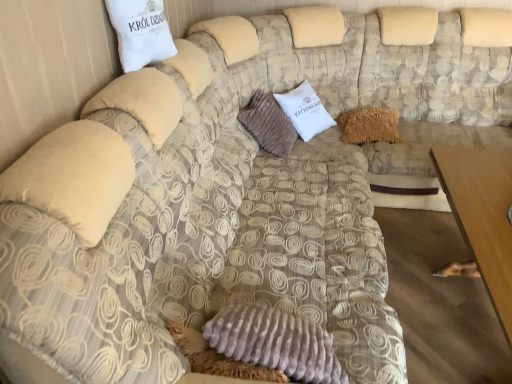
Question: From the image's perspective, would you say fuzzy brown pillow at center, the second pillow in the back-to-front sequence, is positioned over fuzzy brown pillow at center, the third pillow in the left-to-right sequence?

Choices:
 (A) no
 (B) yes

Answer: (A)

Question: Does fuzzy brown pillow at center, the second pillow in the back-to-front sequence, turn towards fuzzy brown pillow at center, which appears as the 1th pillow when viewed from the back?

Choices:
 (A) no
 (B) yes

Answer: (B)

Question: Can you confirm if fuzzy brown pillow at center, the second pillow when ordered from front to back, is positioned to the right of fuzzy brown pillow at center, the 3th pillow when ordered from front to back?

Choices:
 (A) yes
 (B) no

Answer: (B)

Question: Considering the relative sizes of fuzzy brown pillow at center, the 2th pillow from the right, and fuzzy brown pillow at center, placed as the 1th pillow when sorted from right to left, in the image provided, is fuzzy brown pillow at center, the 2th pillow from the right, smaller than fuzzy brown pillow at center, placed as the 1th pillow when sorted from right to left,?

Choices:
 (A) no
 (B) yes

Answer: (A)

Question: Is the position of fuzzy brown pillow at center, arranged as the second pillow when viewed from the left, more distant than that of fuzzy brown pillow at center, the third pillow in the left-to-right sequence?

Choices:
 (A) no
 (B) yes

Answer: (A)

Question: From a real-world perspective, is fuzzy brown pillow at center, the second pillow in the back-to-front sequence, positioned under fuzzy brown pillow at center, placed as the 1th pillow when sorted from right to left, based on gravity?

Choices:
 (A) no
 (B) yes

Answer: (A)

Question: Is fuzzy brown pillow at center, the 3th pillow when ordered from front to back, at the back of brown wooden table at lower right?

Choices:
 (A) yes
 (B) no

Answer: (B)

Question: From a real-world perspective, is brown wooden table at lower right on top of fuzzy brown pillow at center, the third pillow in the left-to-right sequence?

Choices:
 (A) yes
 (B) no

Answer: (B)

Question: Considering the relative sizes of brown wooden table at lower right and fuzzy brown pillow at center, the third pillow in the left-to-right sequence, in the image provided, is brown wooden table at lower right bigger than fuzzy brown pillow at center, the third pillow in the left-to-right sequence,?

Choices:
 (A) no
 (B) yes

Answer: (B)

Question: From a real-world perspective, is brown wooden table at lower right below fuzzy brown pillow at center, the third pillow in the left-to-right sequence?

Choices:
 (A) yes
 (B) no

Answer: (A)

Question: Can you confirm if brown wooden table at lower right is smaller than fuzzy brown pillow at center, the third pillow in the left-to-right sequence?

Choices:
 (A) no
 (B) yes

Answer: (A)

Question: Could you tell me if brown wooden table at lower right is turned towards fuzzy brown pillow at center, the 3th pillow when ordered from front to back?

Choices:
 (A) no
 (B) yes

Answer: (A)

Question: Is fuzzy brown pillow at center, which appears as the 1th pillow when viewed from the back, facing away from fuzzy brown pillow at center, arranged as the second pillow when viewed from the left?

Choices:
 (A) no
 (B) yes

Answer: (A)